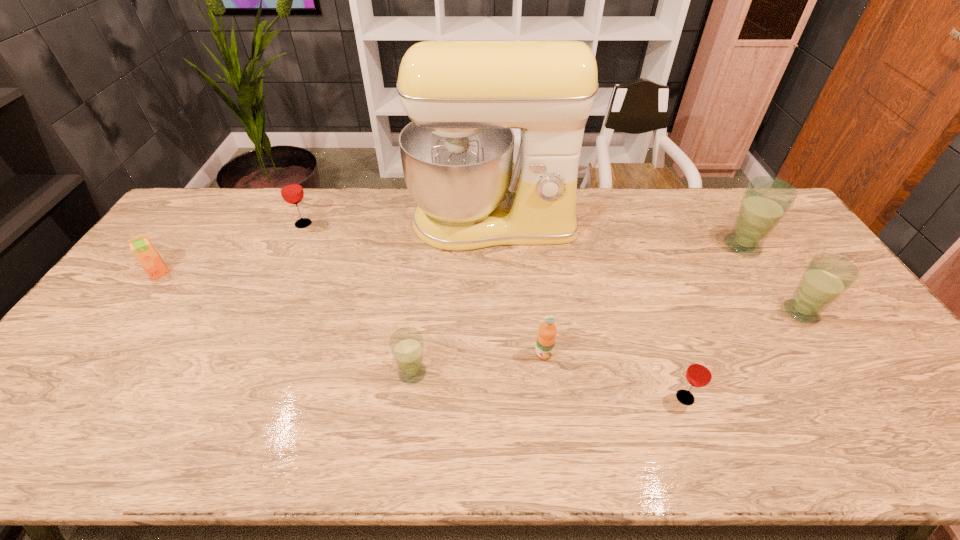
Identify which glass is the third nearest to the fifth farthest object. Please provide its 2D coordinates. Your answer should be formatted as a tuple, i.e. [(x, y)], where the tuple contains the x and y coordinates of a point satisfying the conditions above.

[(407, 345)]

Identify which glass is the fourth nearest to the seventh object from right to left. Please provide its 2D coordinates. Your answer should be formatted as a tuple, i.e. [(x, y)], where the tuple contains the x and y coordinates of a point satisfying the conditions above.

[(827, 276)]

Point out which blue glass is positioned as the second nearest to the farthest blue glass. Please provide its 2D coordinates. Your answer should be formatted as a tuple, i.e. [(x, y)], where the tuple contains the x and y coordinates of a point satisfying the conditions above.

[(407, 345)]

The image size is (960, 540). Find the location of `blue glass that is the third closest to the farther red glass`. blue glass that is the third closest to the farther red glass is located at coordinates 827,276.

Locate an element on the screen. This screenshot has width=960, height=540. vacant space that satisfies the following two spatial constraints: 1. on the side of the tallest object with the control knob; 2. on the left side of the third nearest glass is located at coordinates (496, 312).

This screenshot has height=540, width=960. I want to click on vacant space that satisfies the following two spatial constraints: 1. on the front side of the third farthest glass; 2. on the right side of the fourth farthest object, so click(131, 312).

The height and width of the screenshot is (540, 960). I want to click on free space that satisfies the following two spatial constraints: 1. on the side of the fourth nearest object with the control knob; 2. on the left side of the tallest object, so click(496, 312).

Identify the location of free space that satisfies the following two spatial constraints: 1. on the side of the mixer with the control knob; 2. on the right side of the tallest glass. (493, 246).